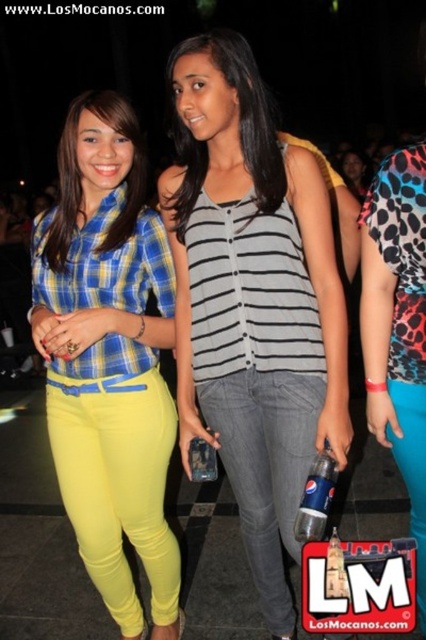
Question: Which object is closer to the camera taking this photo?

Choices:
 (A) matte yellow pants at lower left
 (B) yellow matte pants at left
 (C) plaid fabric shirt at center
 (D) striped fabric tank top at center

Answer: (D)

Question: Which object appears farthest from the camera in this image?

Choices:
 (A) leopard print dress at right
 (B) teal satin skirt at lower right
 (C) matte yellow pants at lower left
 (D) striped fabric top at center

Answer: (C)

Question: Which object is the closest to the teal satin skirt at lower right?

Choices:
 (A) plaid fabric shirt at center
 (B) gray denim jeans at center

Answer: (B)

Question: Does yellow matte pants at left appear on the left side of plaid fabric shirt at center?

Choices:
 (A) yes
 (B) no

Answer: (B)

Question: Considering the relative positions of leopard print dress at right and plaid fabric shirt at center in the image provided, where is leopard print dress at right located with respect to plaid fabric shirt at center?

Choices:
 (A) left
 (B) right

Answer: (B)

Question: In this image, where is gray denim jeans at center located relative to teal satin skirt at lower right?

Choices:
 (A) right
 (B) left

Answer: (B)